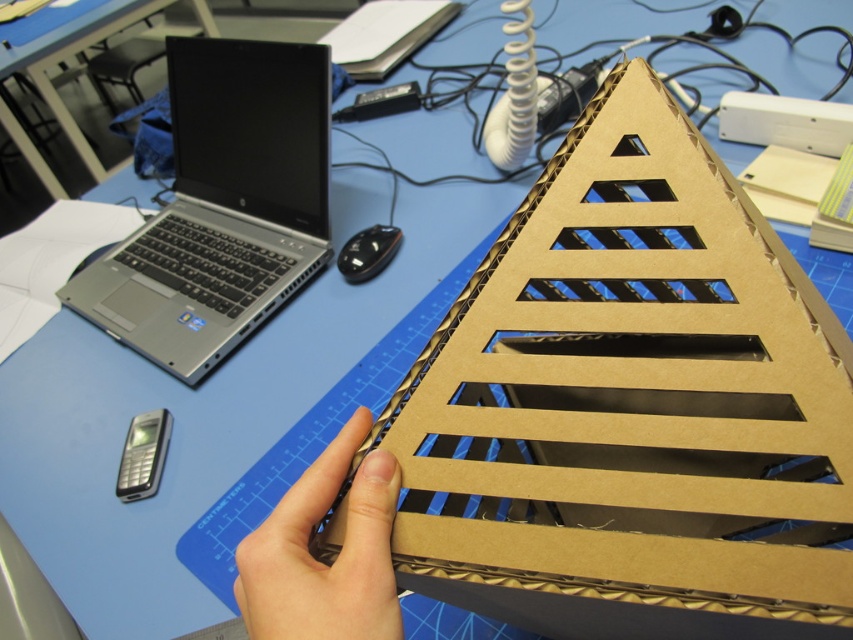
You are standing in front of the workspace shown in the image. There are two points marked on the table surface at coordinates point (94, 259) and point (341, 442). If you want to place a small sticker on the point that is closer to you, which coordinate should you choose?

Point (341, 442) is closer to you than point (94, 259), so you should place the sticker there.